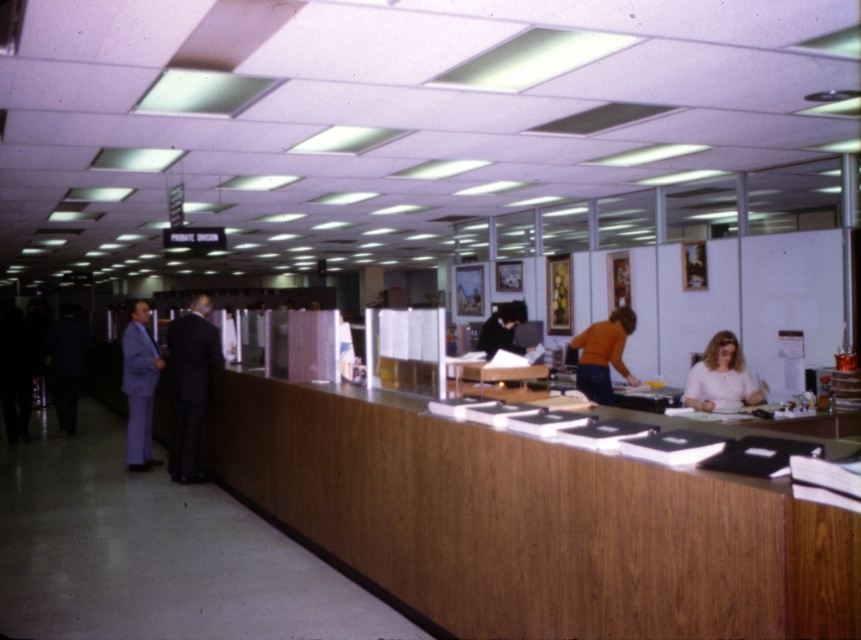
Question: Which object is positioned farthest from the dark suit at center?

Choices:
 (A) matte white blouse at center
 (B) light purple suit at left
 (C) wooden counter at center
 (D) orange sweater at center

Answer: (A)

Question: Which object is the closest to the orange sweater at center?

Choices:
 (A) wooden counter at center
 (B) light purple suit at left
 (C) dark suit at center

Answer: (A)

Question: Is wooden counter at center below light purple suit at left?

Choices:
 (A) yes
 (B) no

Answer: (A)

Question: Can you confirm if wooden counter at center is positioned to the left of light purple suit at left?

Choices:
 (A) no
 (B) yes

Answer: (A)

Question: Which object is the closest to the wooden counter at center?

Choices:
 (A) orange sweater at center
 (B) matte white blouse at center
 (C) light purple suit at left
 (D) dark suit at center

Answer: (D)

Question: Can you confirm if dark suit at center is positioned to the right of orange sweater at center?

Choices:
 (A) no
 (B) yes

Answer: (A)